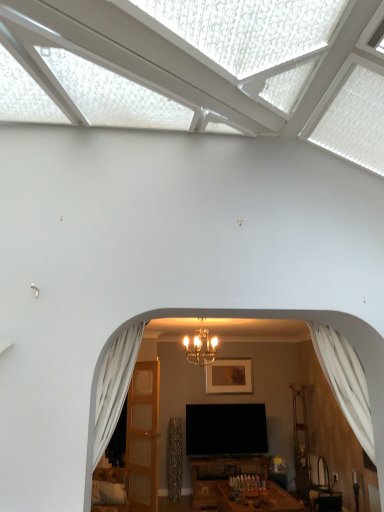
Question: Is light brown wooden door at center beside metallic chandelier at center?

Choices:
 (A) yes
 (B) no

Answer: (B)

Question: From the image's perspective, does light brown wooden door at center appear higher than metallic chandelier at center?

Choices:
 (A) yes
 (B) no

Answer: (B)

Question: From a real-world perspective, is light brown wooden door at center under metallic chandelier at center?

Choices:
 (A) no
 (B) yes

Answer: (B)

Question: Is light brown wooden door at center not within metallic chandelier at center?

Choices:
 (A) no
 (B) yes

Answer: (B)

Question: Is light brown wooden door at center aimed at metallic chandelier at center?

Choices:
 (A) no
 (B) yes

Answer: (A)

Question: Is light brown wooden door at center at the left side of metallic chandelier at center?

Choices:
 (A) no
 (B) yes

Answer: (B)

Question: Is white sheer curtain at right, the first curtain viewed from the right, directly adjacent to metallic chandelier at center?

Choices:
 (A) yes
 (B) no

Answer: (B)

Question: Is white sheer curtain at right, the first curtain viewed from the right, at the right side of metallic chandelier at center?

Choices:
 (A) yes
 (B) no

Answer: (A)

Question: From a real-world perspective, is white sheer curtain at right, the first curtain viewed from the right, beneath metallic chandelier at center?

Choices:
 (A) yes
 (B) no

Answer: (A)

Question: From the image's perspective, is white sheer curtain at right, the first curtain viewed from the right, located above metallic chandelier at center?

Choices:
 (A) no
 (B) yes

Answer: (B)

Question: Is white sheer curtain at right, the first curtain viewed from the right, aimed at metallic chandelier at center?

Choices:
 (A) yes
 (B) no

Answer: (B)

Question: From a real-world perspective, is white sheer curtain at right, placed as the 2th curtain when sorted from left to right, located higher than metallic chandelier at center?

Choices:
 (A) yes
 (B) no

Answer: (B)

Question: From a real-world perspective, does white sheer curtain at left, arranged as the second curtain when viewed from the right, stand above metallic chandelier at center?

Choices:
 (A) yes
 (B) no

Answer: (B)